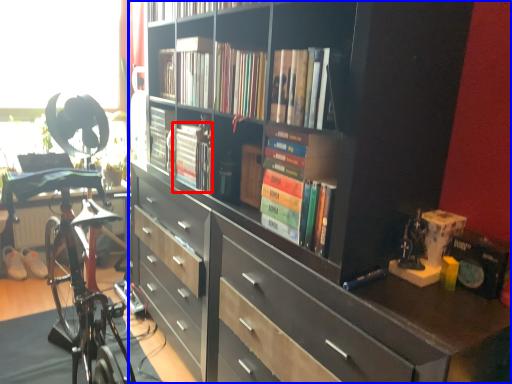
Question: Among these objects, which one is nearest to the camera, book (highlighted by a red box) or bookcase (highlighted by a blue box)?

Choices:
 (A) book
 (B) bookcase

Answer: (B)